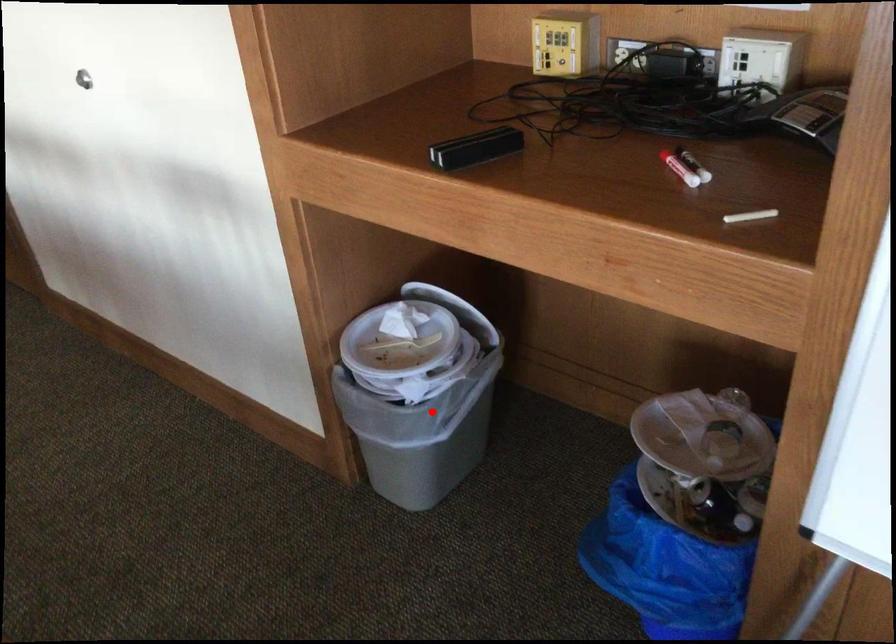
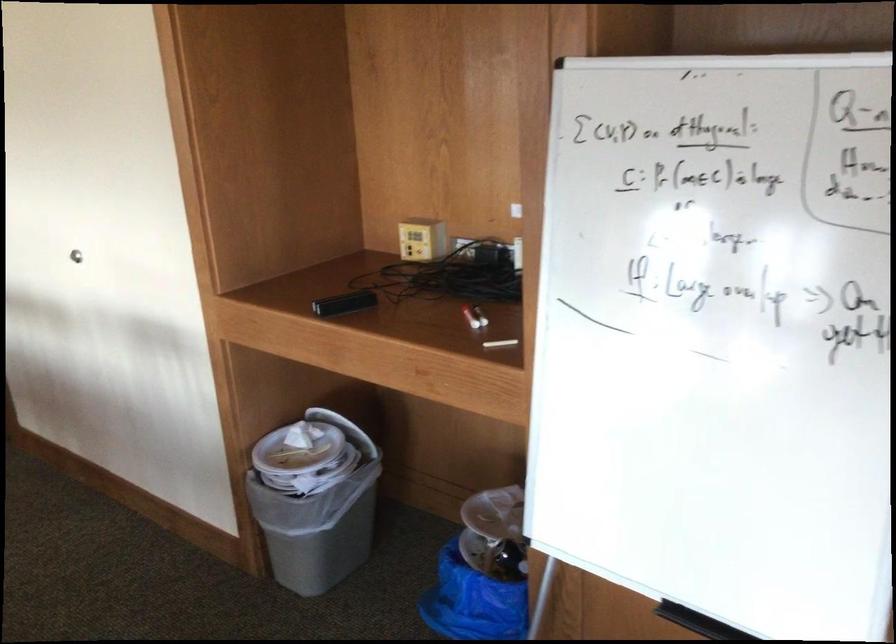
Question: I am providing you with two images of the same scene from different viewpoints. Given a red point in image1, look at the same physical point in image2. Is it:

Choices:
 (A) Closer to the viewpoint
 (B) Farther from the viewpoint

Answer: (B)